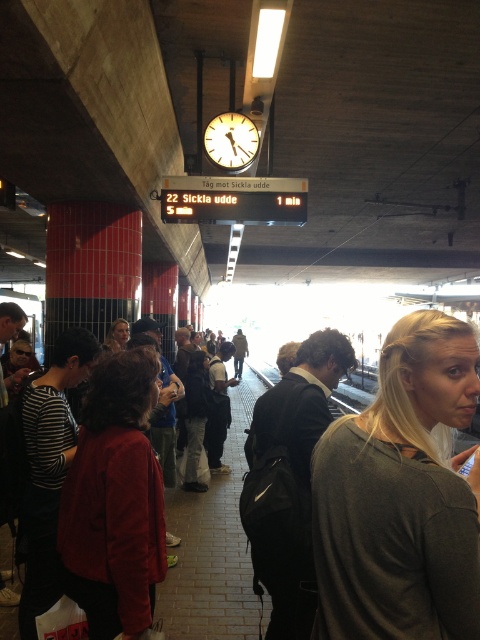
Question: Among these points, which one is farthest from the camera?

Choices:
 (A) (193, 502)
 (B) (460, 579)
 (C) (298, 396)

Answer: (A)

Question: Does dark gray backpack at center have a larger size compared to dark red sweater at center?

Choices:
 (A) yes
 (B) no

Answer: (A)

Question: Which object appears closest to the camera in this image?

Choices:
 (A) velvet red jacket at center
 (B) dark gray backpack at center
 (C) gray matte shirt at center

Answer: (C)

Question: Can you confirm if velvet red jacket at center is positioned above dark gray backpack at center?

Choices:
 (A) no
 (B) yes

Answer: (B)

Question: Which object is closer to the camera taking this photo?

Choices:
 (A) velvet red jacket at center
 (B) dark gray backpack at center
 (C) dark red sweater at center
 (D) metallic clock at upper center

Answer: (A)

Question: Does velvet red jacket at center appear on the right side of metallic clock at upper center?

Choices:
 (A) no
 (B) yes

Answer: (A)